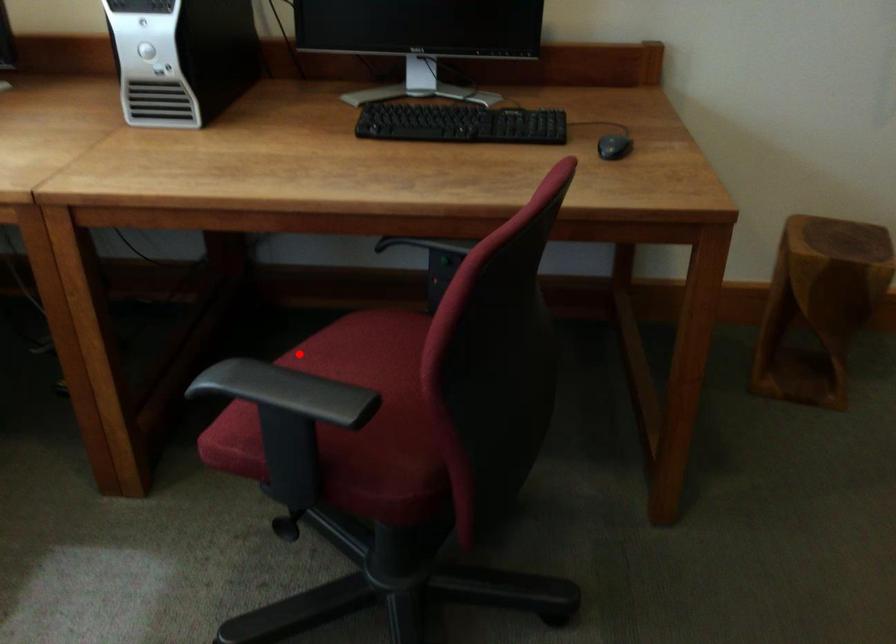
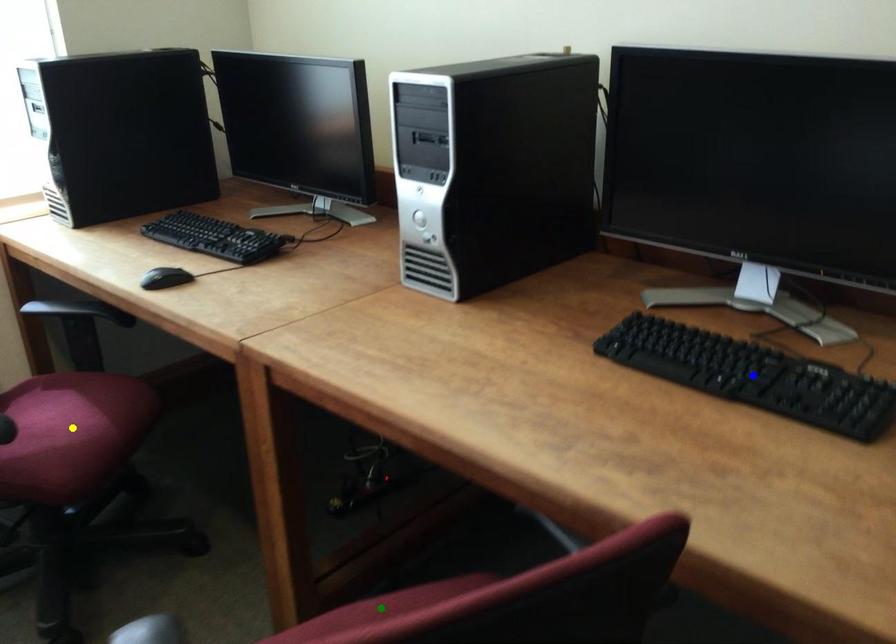
Question: I am providing you with two images of the same scene from different viewpoints. A red point is marked on the first image. You are given multiple points on the second image. Which mark in image 2 goes with the point in image 1?

Choices:
 (A) blue point
 (B) yellow point
 (C) green point

Answer: (C)